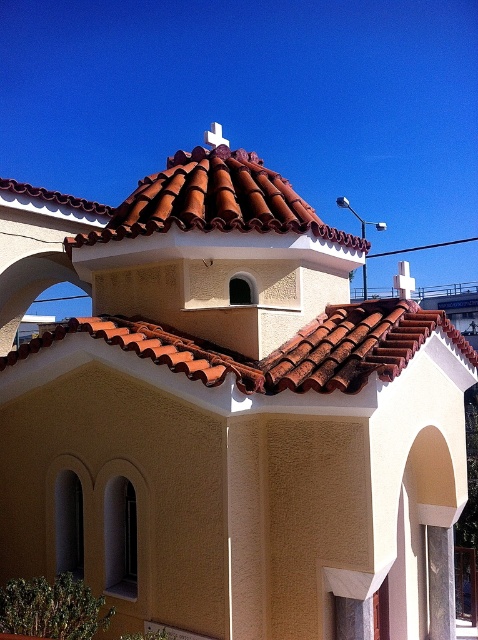
Which is in front, point (408, 301) or point (285, 225)?

Positioned in front is point (285, 225).

The image size is (478, 640). Identify the location of brown clay tiles at center. (279, 348).